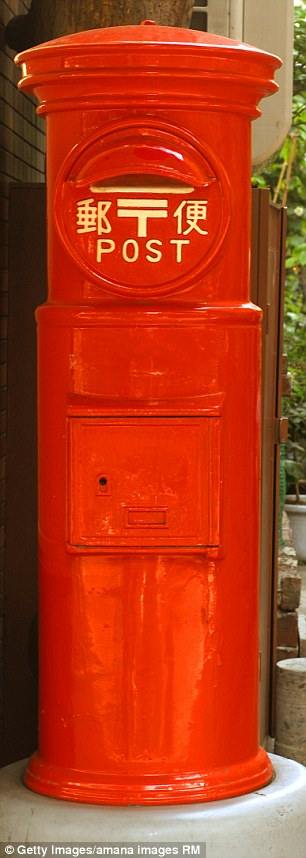
This screenshot has width=306, height=858. In order to click on square metal door in this screenshot , I will do `click(79, 425)`.